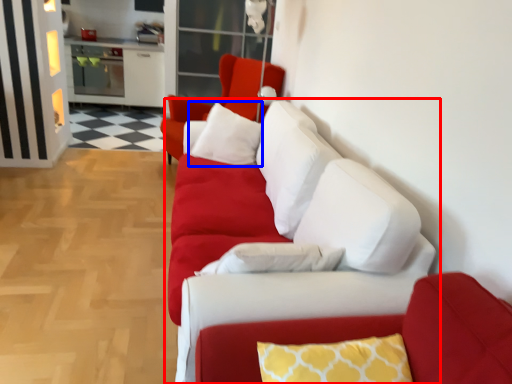
Question: Which object appears farthest to the camera in this image, studio couch (highlighted by a red box) or pillow (highlighted by a blue box)?

Choices:
 (A) studio couch
 (B) pillow

Answer: (B)